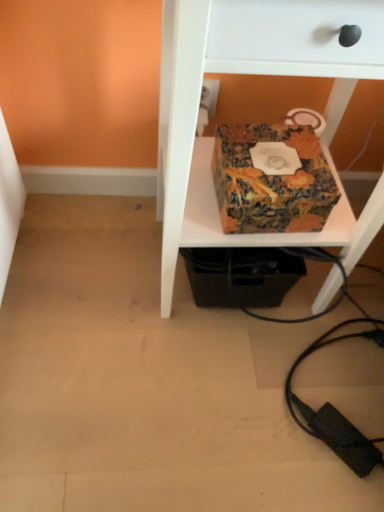
Question: From a real-world perspective, does multicolored fabric box at center stand above marbled paper box at center?

Choices:
 (A) yes
 (B) no

Answer: (A)

Question: Can you confirm if multicolored fabric box at center is wider than marbled paper box at center?

Choices:
 (A) no
 (B) yes

Answer: (B)

Question: Does multicolored fabric box at center come in front of marbled paper box at center?

Choices:
 (A) no
 (B) yes

Answer: (B)

Question: Could you tell me if multicolored fabric box at center is turned towards marbled paper box at center?

Choices:
 (A) no
 (B) yes

Answer: (B)

Question: Is marbled paper box at center at the back of multicolored fabric box at center?

Choices:
 (A) yes
 (B) no

Answer: (A)

Question: Is multicolored fabric box at center placed right next to marbled paper box at center?

Choices:
 (A) yes
 (B) no

Answer: (B)

Question: Can multicolored fabric box at center be found inside marbled paper box at center?

Choices:
 (A) no
 (B) yes

Answer: (A)

Question: Is marbled paper box at center far away from multicolored fabric box at center?

Choices:
 (A) yes
 (B) no

Answer: (B)

Question: From a real-world perspective, is marbled paper box at center positioned over multicolored fabric box at center based on gravity?

Choices:
 (A) yes
 (B) no

Answer: (B)

Question: Can you confirm if marbled paper box at center is taller than multicolored fabric box at center?

Choices:
 (A) no
 (B) yes

Answer: (A)

Question: Considering the relative sizes of marbled paper box at center and multicolored fabric box at center in the image provided, is marbled paper box at center wider than multicolored fabric box at center?

Choices:
 (A) yes
 (B) no

Answer: (B)

Question: Are marbled paper box at center and multicolored fabric box at center making contact?

Choices:
 (A) yes
 (B) no

Answer: (B)

Question: Considering the positions of multicolored fabric box at center and marbled paper box at center in the image, is multicolored fabric box at center bigger or smaller than marbled paper box at center?

Choices:
 (A) small
 (B) big

Answer: (B)